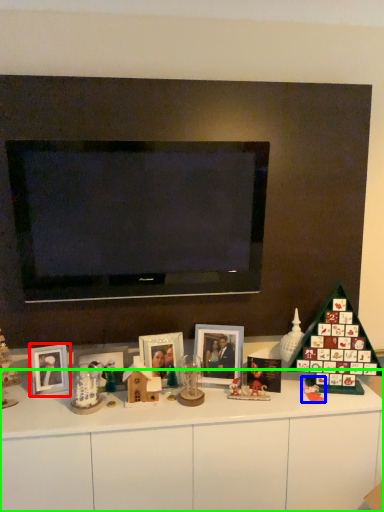
Question: Based on their relative distances, which object is nearer to picture frame (highlighted by a red box)? Choose from toy (highlighted by a blue box) and dresser (highlighted by a green box).

Choices:
 (A) toy
 (B) dresser

Answer: (B)